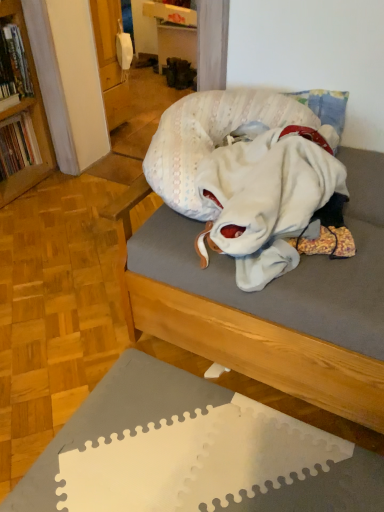
Question: Is white cotton blanket at center far from hardcover book at left, arranged as the second book when ordered from the bottom?

Choices:
 (A) yes
 (B) no

Answer: (A)

Question: Can you confirm if white cotton blanket at center is thinner than hardcover book at left, arranged as the second book when ordered from the bottom?

Choices:
 (A) yes
 (B) no

Answer: (B)

Question: From a real-world perspective, is white cotton blanket at center under hardcover book at left, arranged as the second book when ordered from the bottom?

Choices:
 (A) yes
 (B) no

Answer: (A)

Question: Is white cotton blanket at center positioned beyond the bounds of hardcover book at left, arranged as the second book when ordered from the bottom?

Choices:
 (A) yes
 (B) no

Answer: (A)

Question: From the image's perspective, is white cotton blanket at center over hardcover book at left, which is counted as the 1th book, starting from the top?

Choices:
 (A) no
 (B) yes

Answer: (A)

Question: Can you confirm if white cotton blanket at center is taller than hardcover book at left, which is counted as the 1th book, starting from the top?

Choices:
 (A) no
 (B) yes

Answer: (A)

Question: Is hardcover book at left, arranged as the second book when ordered from the bottom, looking in the opposite direction of wooden studio couch at center?

Choices:
 (A) no
 (B) yes

Answer: (A)

Question: Is hardcover book at left, arranged as the second book when ordered from the bottom, at the right side of wooden studio couch at center?

Choices:
 (A) yes
 (B) no

Answer: (B)

Question: Can you confirm if hardcover book at left, arranged as the second book when ordered from the bottom, is shorter than wooden studio couch at center?

Choices:
 (A) no
 (B) yes

Answer: (B)

Question: Does hardcover book at left, which is counted as the 1th book, starting from the top, lie in front of wooden studio couch at center?

Choices:
 (A) yes
 (B) no

Answer: (B)

Question: Is hardcover book at left, arranged as the second book when ordered from the bottom, wider than wooden studio couch at center?

Choices:
 (A) yes
 (B) no

Answer: (B)

Question: From a real-world perspective, is hardcover book at left, arranged as the second book when ordered from the bottom, beneath wooden studio couch at center?

Choices:
 (A) no
 (B) yes

Answer: (A)

Question: Can you confirm if white cotton blanket at center is positioned to the right of wooden studio couch at center?

Choices:
 (A) no
 (B) yes

Answer: (A)